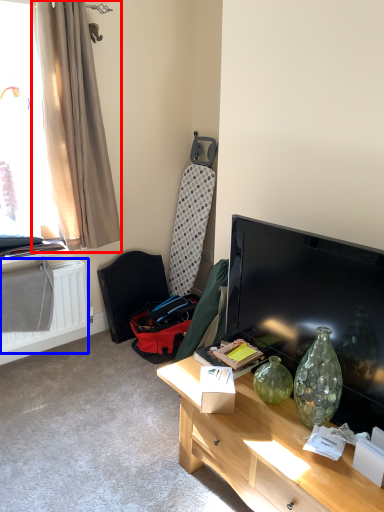
Question: Which point is further to the camera, curtain (highlighted by a red box) or radiator (highlighted by a blue box)?

Choices:
 (A) curtain
 (B) radiator

Answer: (B)